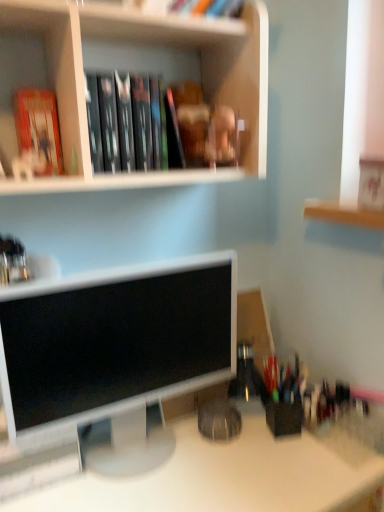
The height and width of the screenshot is (512, 384). In order to click on blank space situated above white glossy desk at center (from a real-world perspective) in this screenshot , I will do `click(194, 459)`.